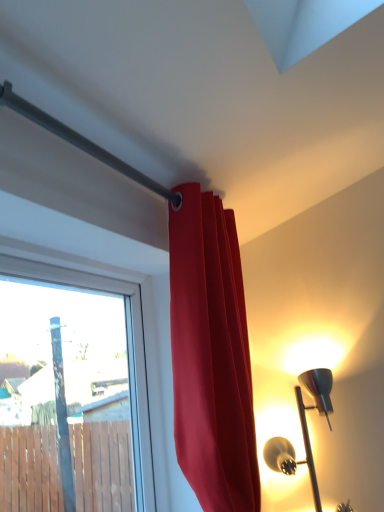
I want to click on metallic gold lamp at upper right, so click(302, 429).

The image size is (384, 512). What do you see at coordinates (302, 429) in the screenshot?
I see `metallic gold lamp at upper right` at bounding box center [302, 429].

Find the location of a particular element. The height and width of the screenshot is (512, 384). metallic gold lamp at upper right is located at coordinates (302, 429).